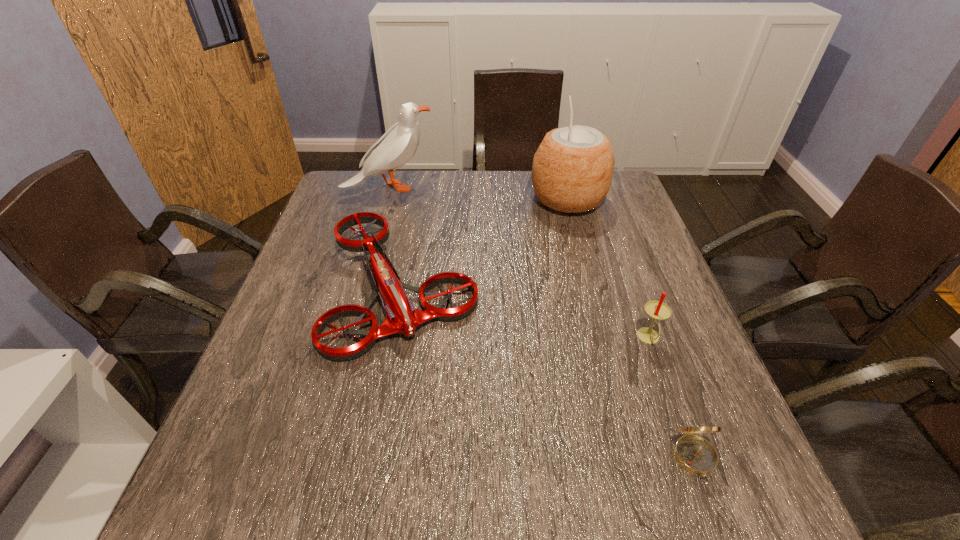
The image size is (960, 540). I want to click on free space in the image that satisfies the following two spatial constraints: 1. on the back side of the drone; 2. on the left side of the coconut, so click(419, 199).

Identify the location of vacant space that satisfies the following two spatial constraints: 1. on the back side of the drone; 2. at the beak of the gull. (420, 187).

You are a GUI agent. You are given a task and a screenshot of the screen. Output one action in this format:
    pyautogui.click(x=<x>, y=<y>)
    Task: Click on the vacant space that satisfies the following two spatial constraints: 1. at the beak of the coconut; 2. on the right side of the gull
    This screenshot has height=540, width=960.
    Given the screenshot: What is the action you would take?
    pyautogui.click(x=387, y=199)

Locate an element on the screen. The width and height of the screenshot is (960, 540). free location that satisfies the following two spatial constraints: 1. at the beak of the gull; 2. on the right side of the drone is located at coordinates (362, 288).

Locate an element on the screen. vacant space that satisfies the following two spatial constraints: 1. at the beak of the gull; 2. on the back side of the third shortest object is located at coordinates (348, 338).

The image size is (960, 540). What are the coordinates of `vacant region that satisfies the following two spatial constraints: 1. on the back side of the drone; 2. on the left side of the coconut` in the screenshot? It's located at [419, 199].

Identify the location of vacant region that satisfies the following two spatial constraints: 1. at the beak of the gull; 2. on the right side of the candle. (348, 338).